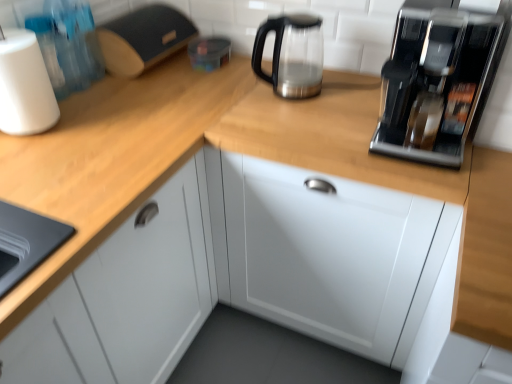
Find the location of a particular element. free space that is in between satin metallic kettle at upper center and sleek metallic coffee machine at upper right is located at coordinates (331, 105).